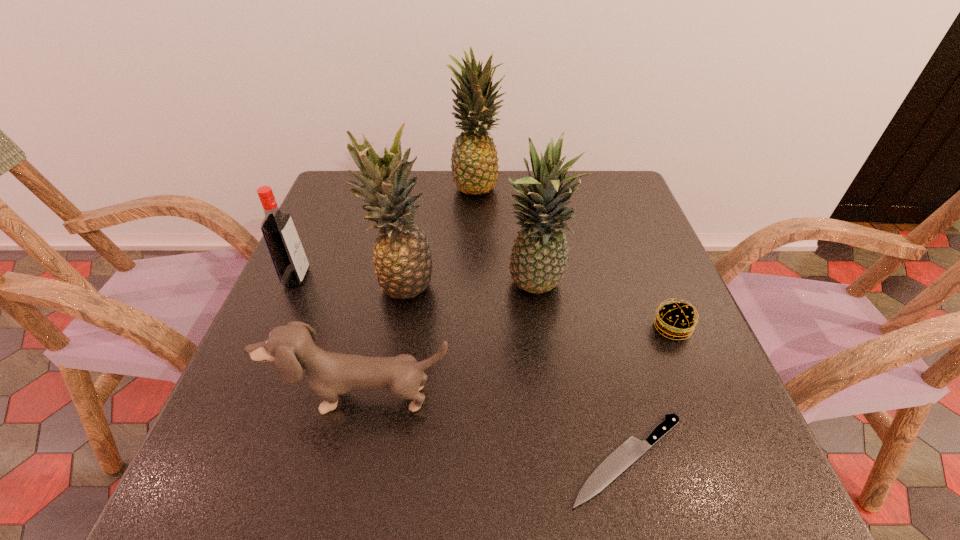
At what (x,y) coordinates should I click in order to perform the action: click on vacant area situated 0.270m on the front and back of the vodka. Please return your answer as a coordinate pair (x, y). This screenshot has height=540, width=960. Looking at the image, I should click on (426, 278).

At what (x,y) coordinates should I click in order to perform the action: click on vacant space located 0.070m at the face of the puppy. Please return your answer as a coordinate pair (x, y). Image resolution: width=960 pixels, height=540 pixels. Looking at the image, I should click on (348, 460).

Locate an element on the screen. Image resolution: width=960 pixels, height=540 pixels. vacant region located on the front of the third nearest object is located at coordinates (742, 496).

In order to click on vacant space located 0.370m on the back of the steak knife in this screenshot , I will do `click(581, 271)`.

The height and width of the screenshot is (540, 960). I want to click on object present at the far edge, so click(x=474, y=167).

The width and height of the screenshot is (960, 540). In order to click on object that is at the near edge in this screenshot , I will do `click(627, 453)`.

Where is `vodka situated at the left edge`? This screenshot has width=960, height=540. vodka situated at the left edge is located at coordinates (285, 248).

Where is `puppy located at the left edge`? The width and height of the screenshot is (960, 540). puppy located at the left edge is located at coordinates (329, 374).

The image size is (960, 540). I want to click on patty that is at the right edge, so click(x=675, y=320).

At what (x,y) coordinates should I click in order to perform the action: click on steak knife present at the right edge. Please return your answer as a coordinate pair (x, y). The width and height of the screenshot is (960, 540). Looking at the image, I should click on (627, 453).